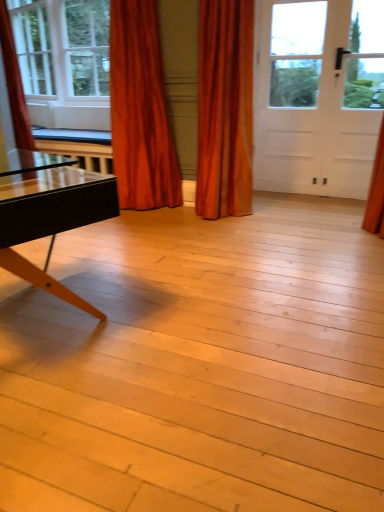
Question: Considering the relative sizes of clear glass window at upper left and white matte door at upper right in the image provided, is clear glass window at upper left smaller than white matte door at upper right?

Choices:
 (A) no
 (B) yes

Answer: (A)

Question: From a real-world perspective, does clear glass window at upper left stand above white matte door at upper right?

Choices:
 (A) no
 (B) yes

Answer: (B)

Question: Can you confirm if clear glass window at upper left is thinner than white matte door at upper right?

Choices:
 (A) yes
 (B) no

Answer: (B)

Question: From the image's perspective, is clear glass window at upper left located beneath white matte door at upper right?

Choices:
 (A) no
 (B) yes

Answer: (A)

Question: Considering the relative positions of clear glass window at upper left and white matte door at upper right in the image provided, is clear glass window at upper left to the right of white matte door at upper right from the viewer's perspective?

Choices:
 (A) yes
 (B) no

Answer: (B)

Question: Is clear glass window at upper left at the left side of white matte door at upper right?

Choices:
 (A) no
 (B) yes

Answer: (B)

Question: Does satin orange curtain at upper left, positioned as the second curtain in right-to-left order, have a greater width compared to white matte door at upper right?

Choices:
 (A) no
 (B) yes

Answer: (B)

Question: Can you confirm if satin orange curtain at upper left, arranged as the 2th curtain when viewed from the left, is smaller than white matte door at upper right?

Choices:
 (A) yes
 (B) no

Answer: (B)

Question: Does satin orange curtain at upper left, positioned as the second curtain in right-to-left order, have a lesser height compared to white matte door at upper right?

Choices:
 (A) yes
 (B) no

Answer: (A)

Question: Is satin orange curtain at upper left, positioned as the second curtain in right-to-left order, thinner than white matte door at upper right?

Choices:
 (A) no
 (B) yes

Answer: (A)

Question: Does satin orange curtain at upper left, arranged as the 2th curtain when viewed from the left, lie in front of white matte door at upper right?

Choices:
 (A) yes
 (B) no

Answer: (A)

Question: From a real-world perspective, is satin orange curtain at upper left, positioned as the second curtain in right-to-left order, beneath white matte door at upper right?

Choices:
 (A) yes
 (B) no

Answer: (A)

Question: Is white matte door at upper right aimed at velvet orange curtain at left, which appears as the third curtain when viewed from the right?

Choices:
 (A) yes
 (B) no

Answer: (B)